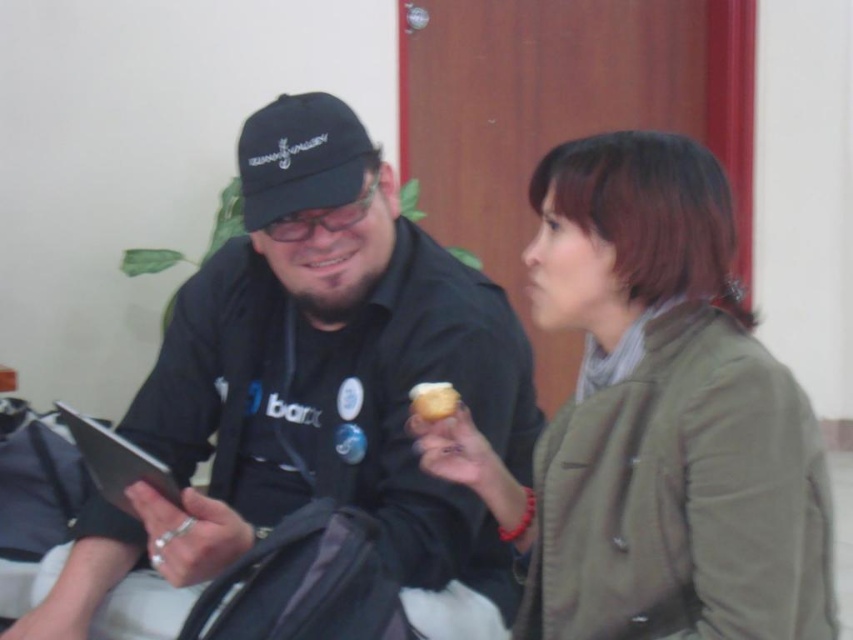
Is olive-green fabric jacket at upper right thinner than golden textured ice cream at center?

No.

Is point (585, 637) in front of point (422, 406)?

Yes, point (585, 637) is closer to viewer.

Locate an element on the screen. olive-green fabric jacket at upper right is located at coordinates (654, 419).

Identify the location of olive-green fabric jacket at upper right. Image resolution: width=853 pixels, height=640 pixels. tap(654, 419).

Which is more to the left, black matte shirt at center or golden textured ice cream at center?

black matte shirt at center is more to the left.

Does point (450, 605) lie in front of point (425, 392)?

No.

Describe the element at coordinates (309, 392) in the screenshot. The image size is (853, 640). I see `black matte shirt at center` at that location.

The image size is (853, 640). Identify the location of black matte shirt at center. (309, 392).

Can you confirm if olive-green fabric jacket at upper right is positioned to the right of black fabric baseball cap at upper center?

Correct, you'll find olive-green fabric jacket at upper right to the right of black fabric baseball cap at upper center.

This screenshot has width=853, height=640. What do you see at coordinates (654, 419) in the screenshot?
I see `olive-green fabric jacket at upper right` at bounding box center [654, 419].

At what (x,y) coordinates should I click in order to perform the action: click on olive-green fabric jacket at upper right. Please return your answer as a coordinate pair (x, y). Image resolution: width=853 pixels, height=640 pixels. Looking at the image, I should click on (654, 419).